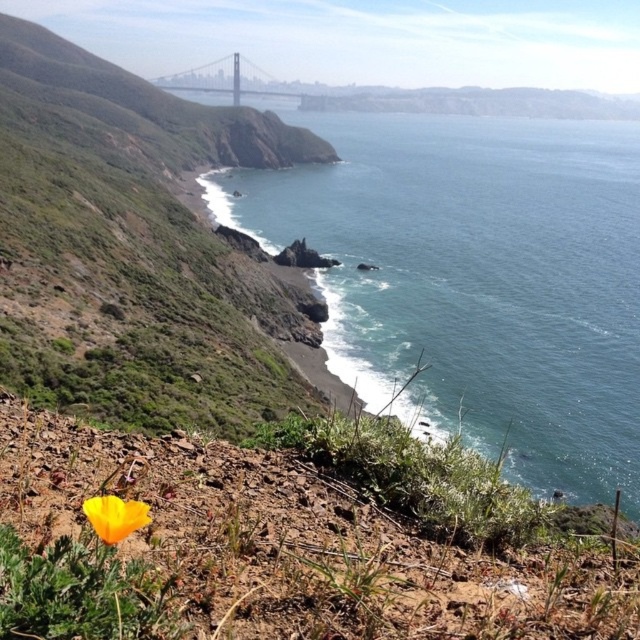
You are a hiker planning to traverse the area shown in the image. You need to decide whether to take a path that goes over the metallic gray bridge at center or climb the green grassy hillside at upper left. Based on the height difference between these two options, which path would require more physical effort?

The green grassy hillside at upper left has a greater height compared to the metallic gray bridge at center, so climbing the green grassy hillside at upper left would require more physical effort.

You are a hiker who wants to cross the metallic gray bridge at center but needs to know if the green grassy hillside at upper left is wider than the bridge. Can you confirm this?

The green grassy hillside at upper left is wider than the metallic gray bridge at center according to the description.

You are a hiker standing at the base of the cliff looking towards the yellow matte flower at lower left and the green grassy hillside at upper left. Which object is closer to your left side?

The green grassy hillside at upper left is positioned on the left side of the yellow matte flower at lower left, so the green grassy hillside at upper left is closer to your left side.